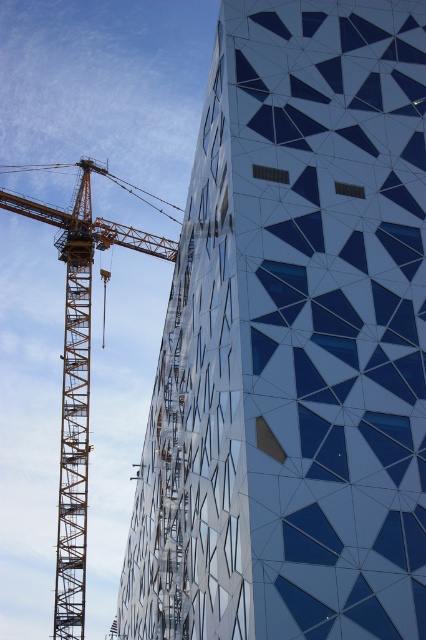
You are a construction worker assessing the site. You need to determine if the white glass building at center is shorter than the orange metallic crane at left. Based on the scene, what can you conclude?

The white glass building at center has a lesser height compared to the orange metallic crane at left, so yes, the white glass building at center is shorter than the orange metallic crane at left.

You are an architect observing the scene. You need to determine the spatial relationship between the white glass building at center and the orange metallic crane at left. Based on the scene, which object is positioned higher in the image?

The orange metallic crane at left is positioned higher than the white glass building at center because the white glass building at center is below it.